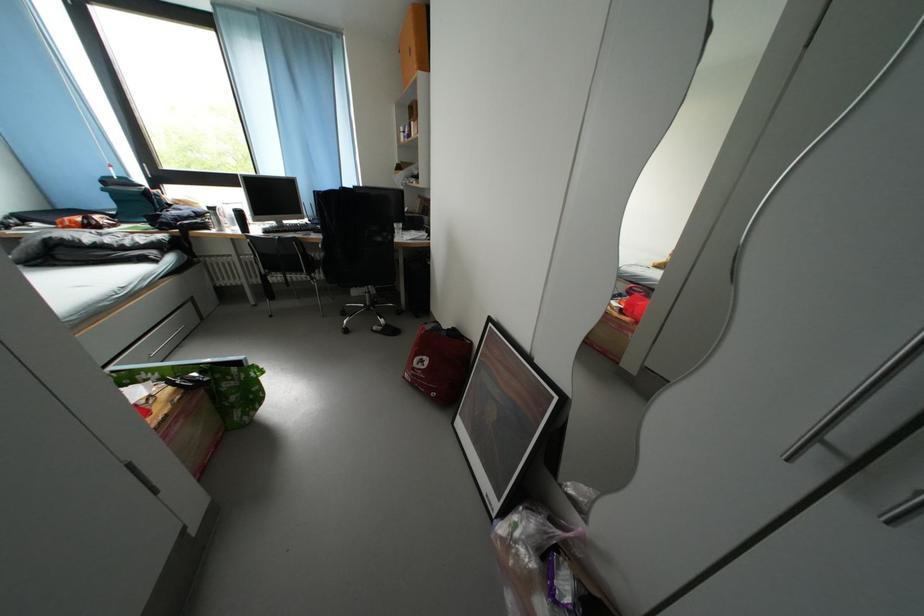
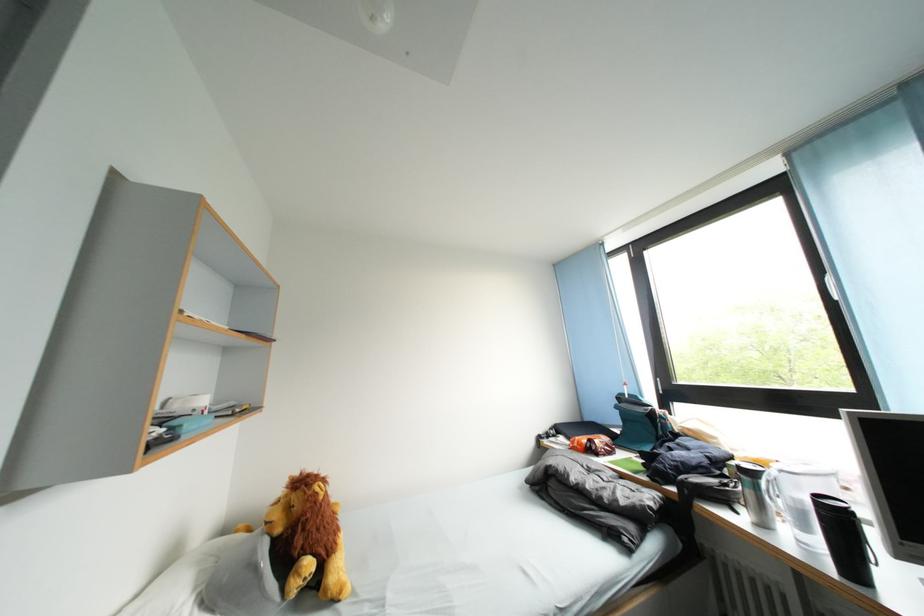
Where in the second image is the point corresponding to [222,214] from the first image?

(759, 479)